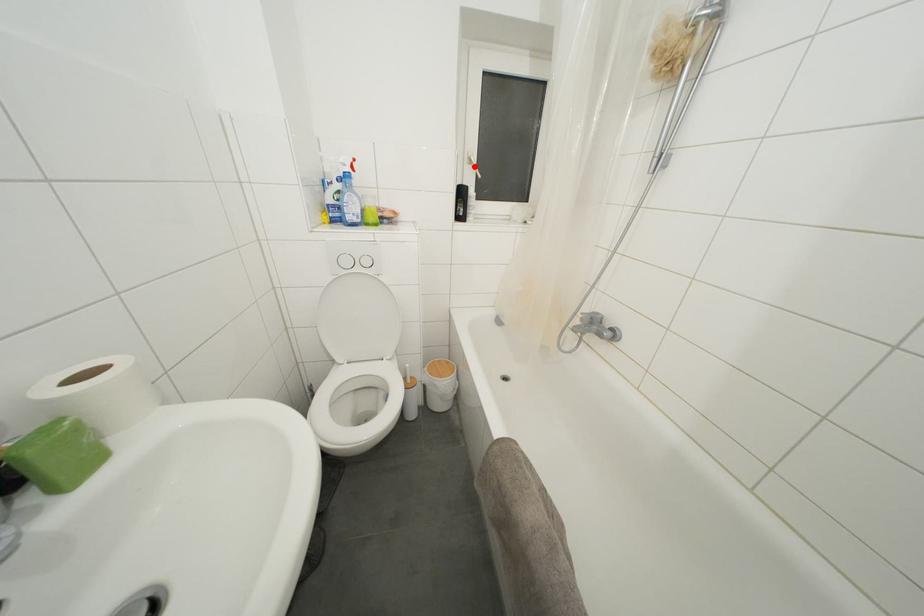
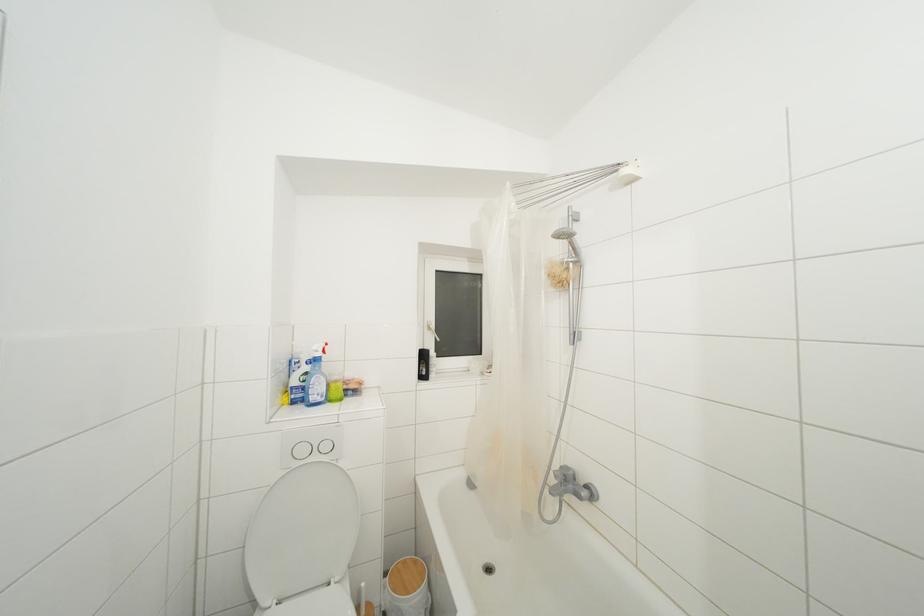
Locate, in the second image, the point that corresponds to the highlighted location in the first image.

(433, 333)